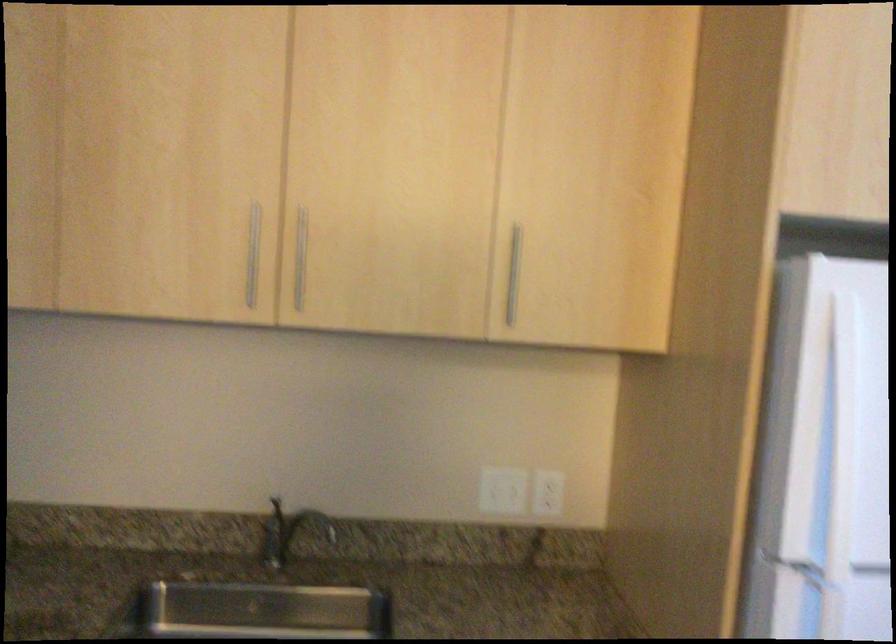
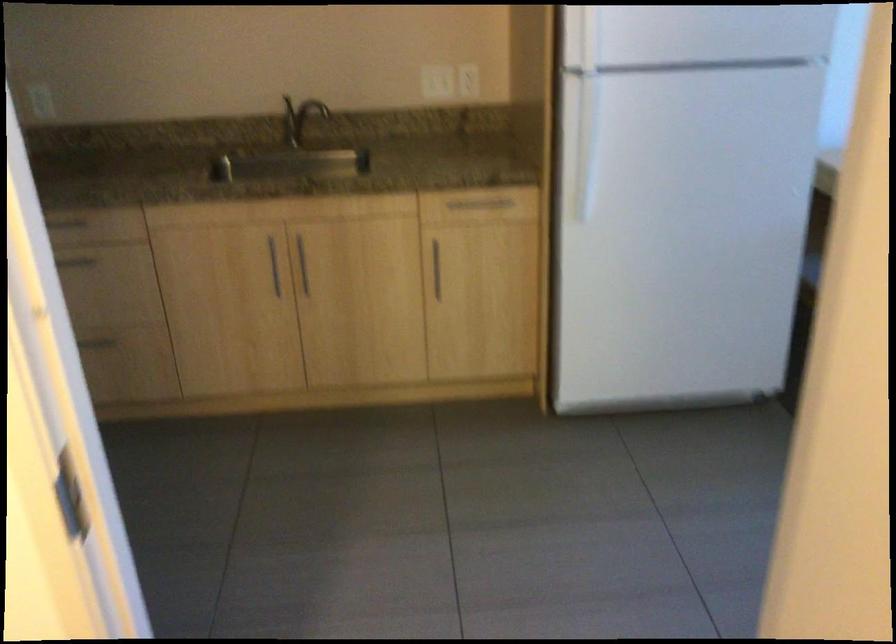
Where in the second image is the point corresponding to (549,489) from the first image?

(468, 80)